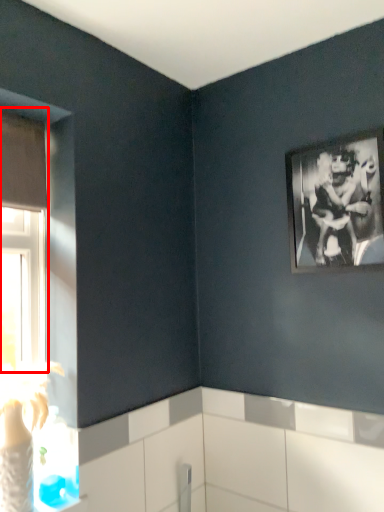
Question: From the image's perspective, what is the correct spatial positioning of window (annotated by the red box) in reference to picture frame?

Choices:
 (A) above
 (B) below

Answer: (B)